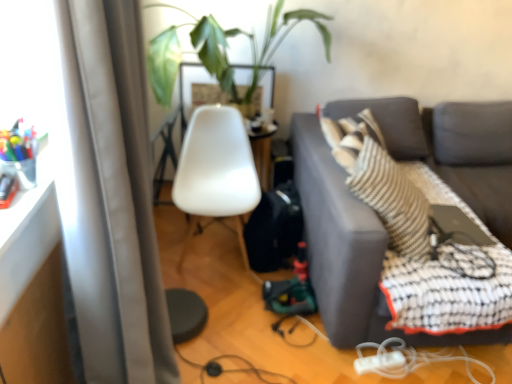
Where is `free space to the back side of white plastic extension cord at lower center`? This screenshot has height=384, width=512. free space to the back side of white plastic extension cord at lower center is located at coordinates (375, 353).